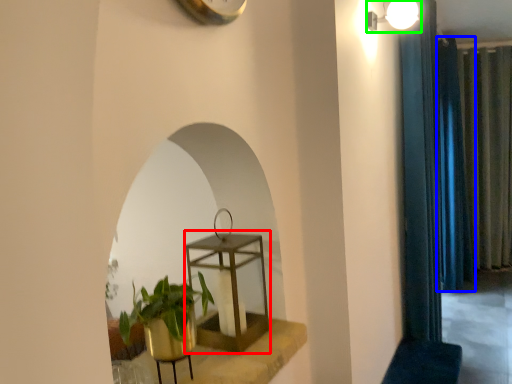
Question: Which object is the closest to the round table (highlighted by a red box)? Choose among these: curtain (highlighted by a blue box) or light fixture (highlighted by a green box).

Choices:
 (A) curtain
 (B) light fixture

Answer: (B)